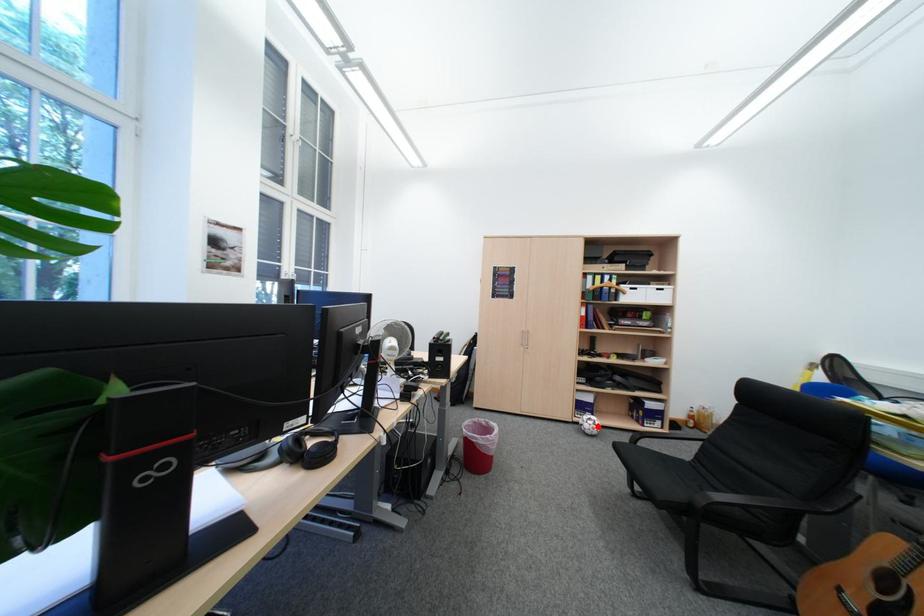
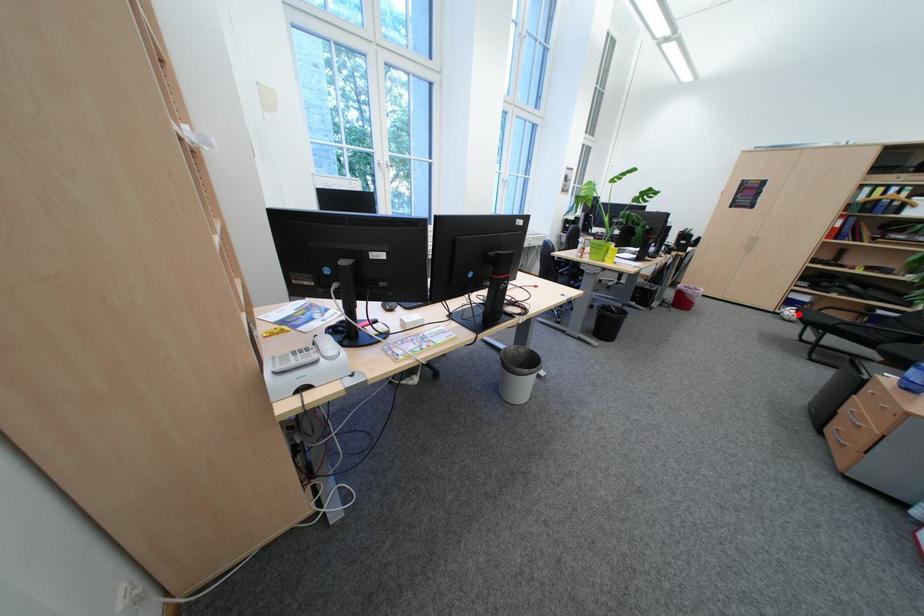
I am providing you with two images of the same scene from different viewpoints. A red point is marked on the first image and another point is marked on the second image. Do the highlighted points in image1 and image2 indicate the same real-world spot?

Yes